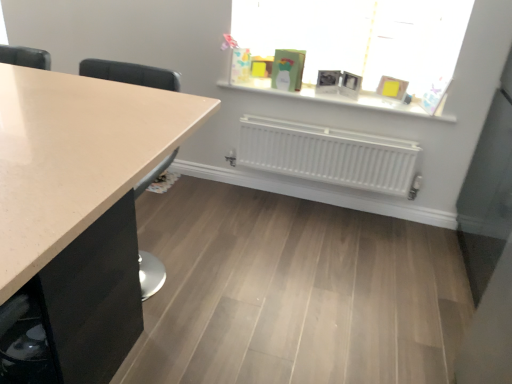
Question: Is white matte window sill at upper center at the back of white matte radiator at center?

Choices:
 (A) no
 (B) yes

Answer: (A)

Question: Is white matte radiator at center positioned behind white matte window sill at upper center?

Choices:
 (A) no
 (B) yes

Answer: (A)

Question: Considering the relative sizes of white matte radiator at center and white matte window sill at upper center in the image provided, is white matte radiator at center thinner than white matte window sill at upper center?

Choices:
 (A) yes
 (B) no

Answer: (A)

Question: Are white matte radiator at center and white matte window sill at upper center making contact?

Choices:
 (A) yes
 (B) no

Answer: (B)

Question: From the image's perspective, would you say white matte radiator at center is shown under white matte window sill at upper center?

Choices:
 (A) no
 (B) yes

Answer: (B)

Question: Would you say white matte radiator at center is outside white matte window sill at upper center?

Choices:
 (A) no
 (B) yes

Answer: (B)

Question: Is white matte window sill at upper center inside matte glass window at upper center?

Choices:
 (A) yes
 (B) no

Answer: (B)

Question: Considering the relative sizes of matte glass window at upper center and white matte window sill at upper center in the image provided, is matte glass window at upper center taller than white matte window sill at upper center?

Choices:
 (A) no
 (B) yes

Answer: (B)

Question: Does matte glass window at upper center have a lesser height compared to white matte window sill at upper center?

Choices:
 (A) yes
 (B) no

Answer: (B)

Question: Are matte glass window at upper center and white matte window sill at upper center making contact?

Choices:
 (A) yes
 (B) no

Answer: (B)

Question: Does matte glass window at upper center have a greater width compared to white matte window sill at upper center?

Choices:
 (A) yes
 (B) no

Answer: (A)

Question: From a real-world perspective, is matte glass window at upper center below white matte window sill at upper center?

Choices:
 (A) no
 (B) yes

Answer: (A)

Question: From the image's perspective, would you say white matte window sill at upper center is shown under matte glass window at upper center?

Choices:
 (A) yes
 (B) no

Answer: (A)